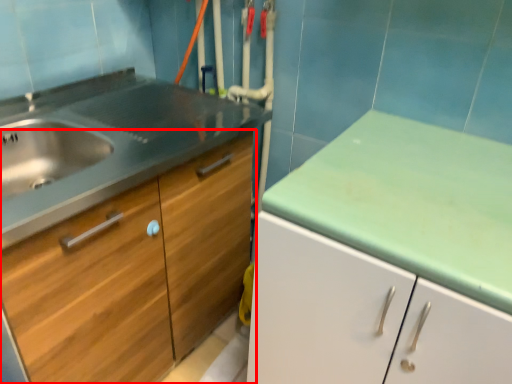
Question: Considering the relative positions of cabinetry (annotated by the red box) and drawer in the image provided, where is cabinetry (annotated by the red box) located with respect to the staircase?

Choices:
 (A) right
 (B) left

Answer: (A)